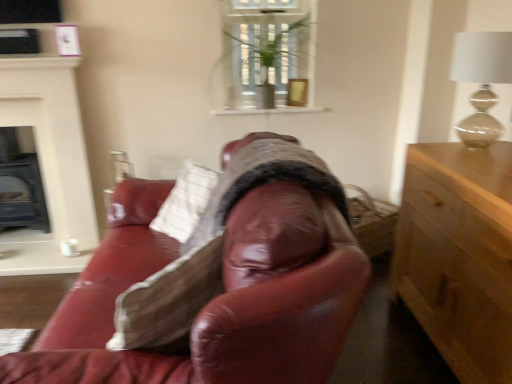
Question: Is matte black fireplace at left wider than light wood cabinet at right?

Choices:
 (A) no
 (B) yes

Answer: (A)

Question: From the image's perspective, is matte black fireplace at left located beneath light wood cabinet at right?

Choices:
 (A) no
 (B) yes

Answer: (A)

Question: Is matte black fireplace at left positioned beyond the bounds of light wood cabinet at right?

Choices:
 (A) no
 (B) yes

Answer: (B)

Question: Is the position of matte black fireplace at left less distant than that of light wood cabinet at right?

Choices:
 (A) no
 (B) yes

Answer: (A)

Question: Considering the relative sizes of matte black fireplace at left and light wood cabinet at right in the image provided, is matte black fireplace at left bigger than light wood cabinet at right?

Choices:
 (A) yes
 (B) no

Answer: (B)

Question: Can you confirm if matte black fireplace at left is taller than light wood cabinet at right?

Choices:
 (A) yes
 (B) no

Answer: (B)

Question: Considering the relative sizes of white painted wood fireplace at left and light wood cabinet at right in the image provided, is white painted wood fireplace at left smaller than light wood cabinet at right?

Choices:
 (A) no
 (B) yes

Answer: (B)

Question: From the image's perspective, does white painted wood fireplace at left appear lower than light wood cabinet at right?

Choices:
 (A) no
 (B) yes

Answer: (A)

Question: Considering the relative sizes of white painted wood fireplace at left and light wood cabinet at right in the image provided, is white painted wood fireplace at left thinner than light wood cabinet at right?

Choices:
 (A) yes
 (B) no

Answer: (A)

Question: Is white painted wood fireplace at left turned away from light wood cabinet at right?

Choices:
 (A) yes
 (B) no

Answer: (B)

Question: Is white painted wood fireplace at left bigger than light wood cabinet at right?

Choices:
 (A) no
 (B) yes

Answer: (A)

Question: Are white painted wood fireplace at left and light wood cabinet at right far apart?

Choices:
 (A) yes
 (B) no

Answer: (A)

Question: Does white painted wood fireplace at left have a lesser height compared to green leafy plant at upper center?

Choices:
 (A) no
 (B) yes

Answer: (A)